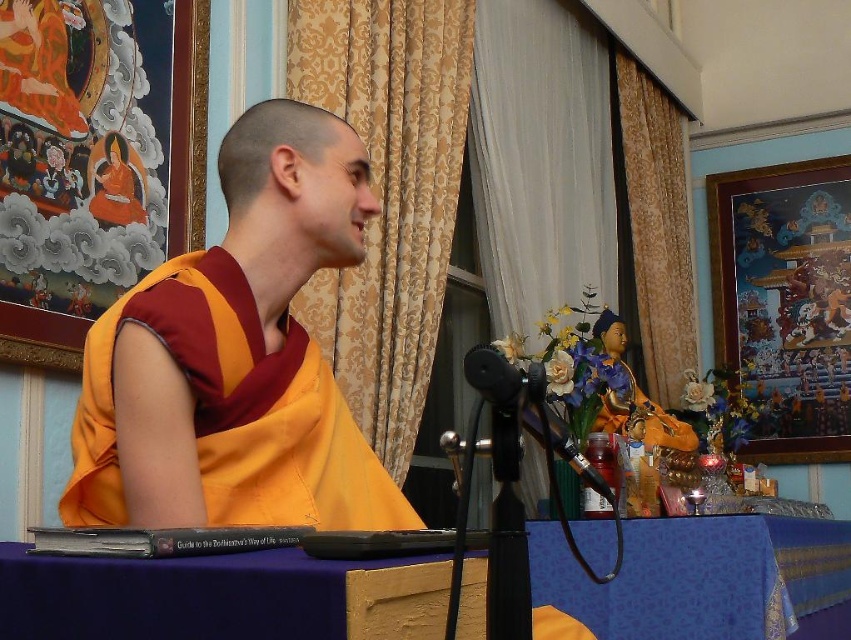
Which is in front, point (303, 163) or point (517, 420)?

Point (517, 420)

Is yellow silk robe at center bigger than black matte microphone at center?

Indeed, yellow silk robe at center has a larger size compared to black matte microphone at center.

Is point (201, 257) closer to viewer compared to point (498, 371)?

That is False.

Image resolution: width=851 pixels, height=640 pixels. In order to click on yellow silk robe at center in this screenshot , I will do `click(236, 356)`.

Is point (309, 227) farther from camera compared to point (53, 634)?

Yes, point (309, 227) is behind point (53, 634).

Looking at this image, does yellow silk robe at center have a lesser width compared to purple fabric table at lower center?

Yes, yellow silk robe at center is thinner than purple fabric table at lower center.

Is point (233, 497) farther from camera compared to point (375, 563)?

Yes, point (233, 497) is farther from viewer.

Where is `yellow silk robe at center`? yellow silk robe at center is located at coordinates (236, 356).

Which is more to the left, purple fabric table at lower center or black matte microphone at center?

From the viewer's perspective, black matte microphone at center appears more on the left side.

Who is shorter, purple fabric table at lower center or black matte microphone at center?

Standing shorter between the two is black matte microphone at center.

Is point (631, 529) closer to camera compared to point (512, 410)?

No, (631, 529) is further to viewer.

Locate an element on the screen. purple fabric table at lower center is located at coordinates (700, 577).